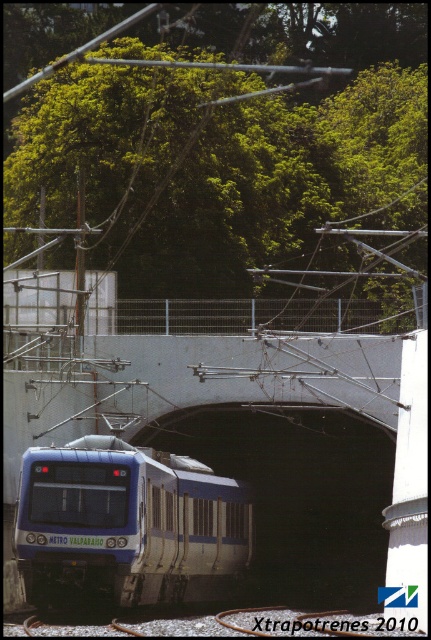
You are standing at the origin point of the coordinate system in the image. The blue metallic train at lower left is located at point (128, 524). If you want to walk towards the blue metallic train at lower left, in which direction should you move?

To reach the blue metallic train at lower left located at point (128, 524) from the origin, you should move towards the lower left direction since the train is positioned at lower left in the image.

You are standing in front of the Metro Valparaiso train exiting the tunnel. There are two points marked on the train, one at coordinates point (186, 268) and another at point (349, 492). Which point is closer to you?

Point (349, 492) is closer to you because it is less further to the camera than point (186, 268).

You are a drone operator trying to fly a drone through the space between the green leafy tree at upper center and the black smooth tunnel at center. The drone has a wingspan of 1 meter. Can the drone safely pass through this space?

The green leafy tree at upper center might be wider than the black smooth tunnel at center, so there is uncertainty about the available space. The drone operator should assess the actual width difference before attempting to fly through to ensure the 1 meter wingspan can fit safely.